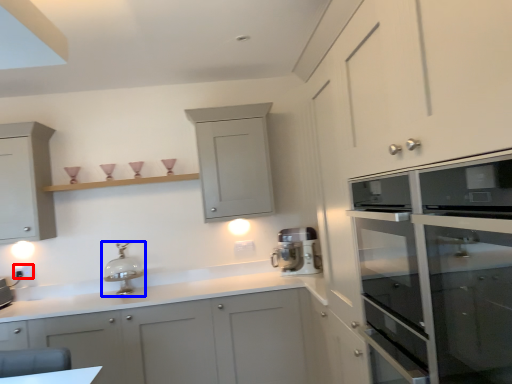
Question: Which object appears closest to the camera in this image, electric outlet (highlighted by a red box) or kitchen appliance (highlighted by a blue box)?

Choices:
 (A) electric outlet
 (B) kitchen appliance

Answer: (B)